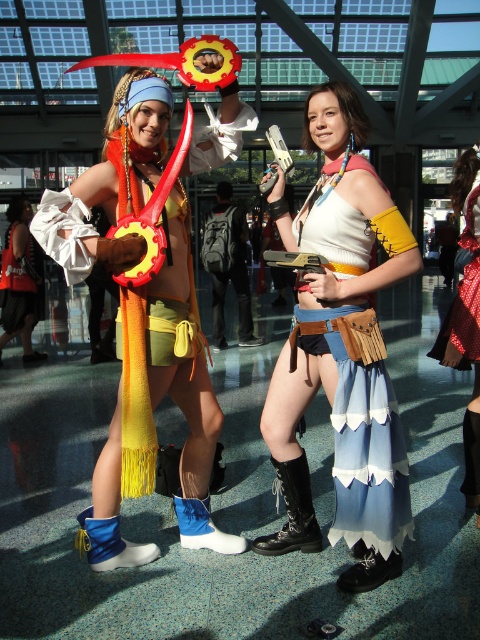
Question: Among these points, which one is nearest to the camera?

Choices:
 (A) (175, 506)
 (B) (196, 496)
 (C) (2, 272)
 (D) (76, 518)

Answer: (B)

Question: Does matte white skirt at center lie in front of yellow fringed scarf at left?

Choices:
 (A) yes
 (B) no

Answer: (A)

Question: Which object appears closest to the camera in this image?

Choices:
 (A) black leather boot at lower center
 (B) matte white skirt at center
 (C) yellow fringed scarf at left
 (D) silky red dress at center

Answer: (B)

Question: Does silky red dress at center have a larger size compared to black leather boot at lower center?

Choices:
 (A) yes
 (B) no

Answer: (A)

Question: Which of the following is the closest to the observer?

Choices:
 (A) (444, 321)
 (B) (152, 141)

Answer: (B)

Question: Can you confirm if matte yellow scarf at left is positioned to the left of yellow fringed scarf at left?

Choices:
 (A) yes
 (B) no

Answer: (B)